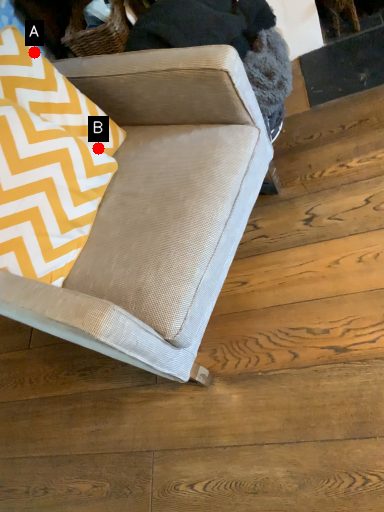
Question: Two points are circled on the image, labeled by A and B beside each circle. Among these points, which one is nearest to the camera?

Choices:
 (A) A is closer
 (B) B is closer

Answer: (A)